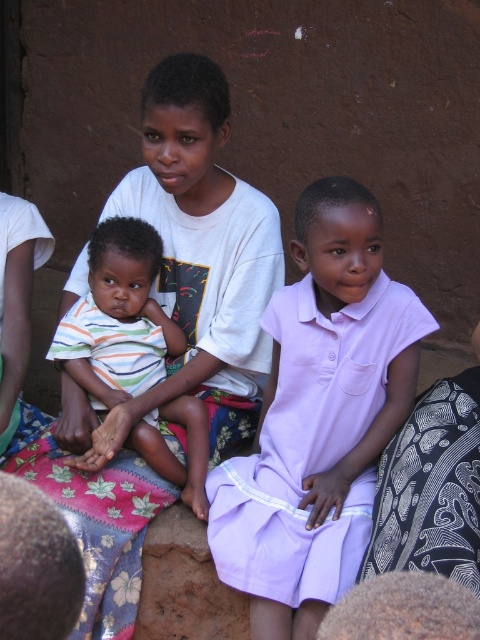
You are a photographer trying to capture a group photo of the lavender cotton dress at center and the striped cotton shirt at center. Since you want to ensure both are in the frame, which direction should you position yourself relative to the subjects?

You should position yourself to the left of the subjects because the lavender cotton dress at center is to the right of the striped cotton shirt at center, so placing yourself to the left will ensure both are visible in the frame.

Based on the photo, you are standing in front of the image and want to know which of the two points, point (259,536) or point (121,358), is nearer to you. Can you determine this based on their positions?

Point (259,536) is closer to the camera than point (121,358), so it is nearer to you.